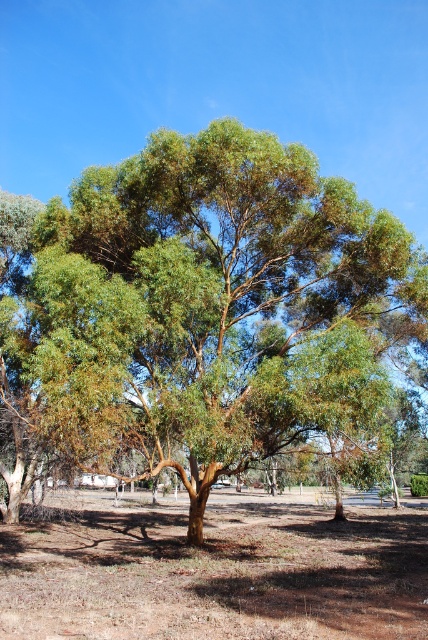
You are a gardener who wants to plant a new flower bed around the green rough bark tree at center. Considering the brown dry soil at center, what should you be cautious about?

The green rough bark tree at center is above the brown dry soil at center, so you should be cautious about the dry soil conditions which may require additional watering to ensure the flowers thrive.

You are standing at the center of the image and want to walk towards the green rough bark tree at center. In which direction should you move?

Since the green rough bark tree at center is located at the center of the image, you are already standing at the same position as the tree. Therefore, you don not need to move in any direction.